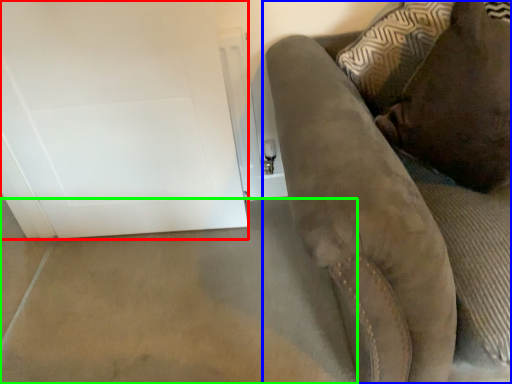
Question: Based on their relative distances, which object is farther from glass door (highlighted by a red box)? Choose from furniture (highlighted by a blue box) and concrete (highlighted by a green box).

Choices:
 (A) furniture
 (B) concrete

Answer: (A)